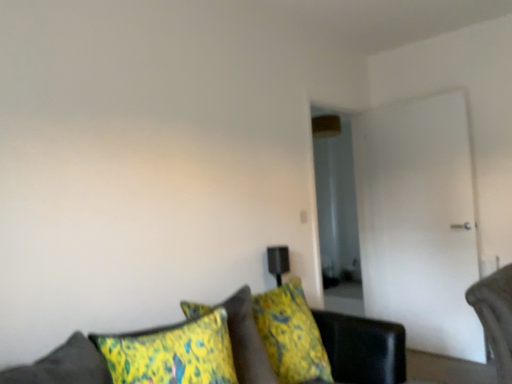
Where is `velvet green couch at lower center`? This screenshot has height=384, width=512. velvet green couch at lower center is located at coordinates (362, 348).

Locate an element on the screen. white glossy door at right is located at coordinates (419, 221).

Is white glossy door at right taller than yellow-green fabric pillow at lower center?

Yes.

At what (x,y) coordinates should I click in order to perform the action: click on pillow beneath the white glossy door at right (from a real-world perspective). Please return your answer as a coordinate pair (x, y). Image resolution: width=512 pixels, height=384 pixels. Looking at the image, I should click on (173, 354).

Would you say yellow-green fabric pillow at lower center is part of white glossy door at right's contents?

No, yellow-green fabric pillow at lower center is not inside white glossy door at right.

Can you confirm if white glossy door at right is bigger than yellow-green fabric pillow at lower center?

Yes, white glossy door at right is bigger than yellow-green fabric pillow at lower center.

Is point (126, 371) closer or farther from the camera than point (460, 164)?

Point (126, 371) is closer to the camera than point (460, 164).

This screenshot has height=384, width=512. I want to click on glass door that appears behind the yellow-green fabric pillow at lower center, so click(419, 221).

Does yellow-green fabric pillow at lower center have a lesser height compared to white glossy door at right?

Yes, yellow-green fabric pillow at lower center is shorter than white glossy door at right.

From a real-world perspective, is yellow-green fabric pillow at lower center located beneath white glossy door at right?

Yes, from a real-world perspective, yellow-green fabric pillow at lower center is beneath white glossy door at right.

Is there a large distance between yellow-green fabric pillow at lower center and velvet green couch at lower center?

They are positioned close to each other.

Would you say yellow-green fabric pillow at lower center is to the left or to the right of velvet green couch at lower center in the picture?

From the image, it's evident that yellow-green fabric pillow at lower center is to the left of velvet green couch at lower center.

Considering the relative sizes of yellow-green fabric pillow at lower center and velvet green couch at lower center in the image provided, is yellow-green fabric pillow at lower center shorter than velvet green couch at lower center?

Yes.

From the picture: Would you say yellow-green fabric pillow at lower center contains velvet green couch at lower center?

No, velvet green couch at lower center is not surrounded by yellow-green fabric pillow at lower center.

From a real-world perspective, who is located lower, velvet green couch at lower center or yellow-green fabric pillow at lower center?

velvet green couch at lower center, from a real-world perspective.

Considering the sizes of objects velvet green couch at lower center and yellow-green fabric pillow at lower center in the image provided, who is wider, velvet green couch at lower center or yellow-green fabric pillow at lower center?

velvet green couch at lower center.

Is velvet green couch at lower center bigger or smaller than yellow-green fabric pillow at lower center?

Clearly, velvet green couch at lower center is larger in size than yellow-green fabric pillow at lower center.

At what (x,y) coordinates should I click in order to perform the action: click on studio couch below the yellow-green fabric pillow at lower center (from the image's perspective). Please return your answer as a coordinate pair (x, y). This screenshot has height=384, width=512. Looking at the image, I should click on (362, 348).

Is velvet green couch at lower center taller than white glossy door at right?

No.

In the scene shown: From the image's perspective, which one is positioned lower, velvet green couch at lower center or white glossy door at right?

velvet green couch at lower center, from the image's perspective.

From a real-world perspective, is velvet green couch at lower center located beneath white glossy door at right?

Correct, in the physical world, velvet green couch at lower center is lower than white glossy door at right.

Considering the relative positions of velvet green couch at lower center and white glossy door at right in the image provided, is velvet green couch at lower center to the left or to the right of white glossy door at right?

velvet green couch at lower center is to the left of white glossy door at right.

Does white glossy door at right appear on the left side of velvet green couch at lower center?

No.

From a real-world perspective, is white glossy door at right beneath velvet green couch at lower center?

No.

Is white glossy door at right wider than velvet green couch at lower center?

No, white glossy door at right is not wider than velvet green couch at lower center.

Identify the location of pillow below the white glossy door at right (from the image's perspective). The width and height of the screenshot is (512, 384). (173, 354).

At what (x,y) coordinates should I click in order to perform the action: click on pillow located in front of the white glossy door at right. Please return your answer as a coordinate pair (x, y). The image size is (512, 384). Looking at the image, I should click on (173, 354).

Which object lies nearer to the anchor point white glossy door at right, yellow-green fabric pillow at lower center or velvet green couch at lower center?

The object closer to white glossy door at right is velvet green couch at lower center.

Considering their positions, is yellow-green fabric pillow at lower center positioned further to velvet green couch at lower center than white glossy door at right?

white glossy door at right lies further to velvet green couch at lower center than the other object.

When comparing their distances from white glossy door at right, does velvet green couch at lower center or yellow-green fabric pillow at lower center seem closer?

Based on the image, velvet green couch at lower center appears to be nearer to white glossy door at right.

Estimate the real-world distances between objects in this image. Which object is further from yellow-green fabric pillow at lower center, velvet green couch at lower center or white glossy door at right?

Based on the image, white glossy door at right appears to be further to yellow-green fabric pillow at lower center.

Consider the image. Which object lies further to the anchor point yellow-green fabric pillow at lower center, white glossy door at right or velvet green couch at lower center?

The object further to yellow-green fabric pillow at lower center is white glossy door at right.

Looking at the image, which one is located closer to velvet green couch at lower center, white glossy door at right or yellow-green fabric pillow at lower center?

The object closer to velvet green couch at lower center is yellow-green fabric pillow at lower center.

Find the location of a particular element. Image resolution: width=512 pixels, height=384 pixels. pillow between velvet green couch at lower center and white glossy door at right from front to back is located at coordinates (173, 354).